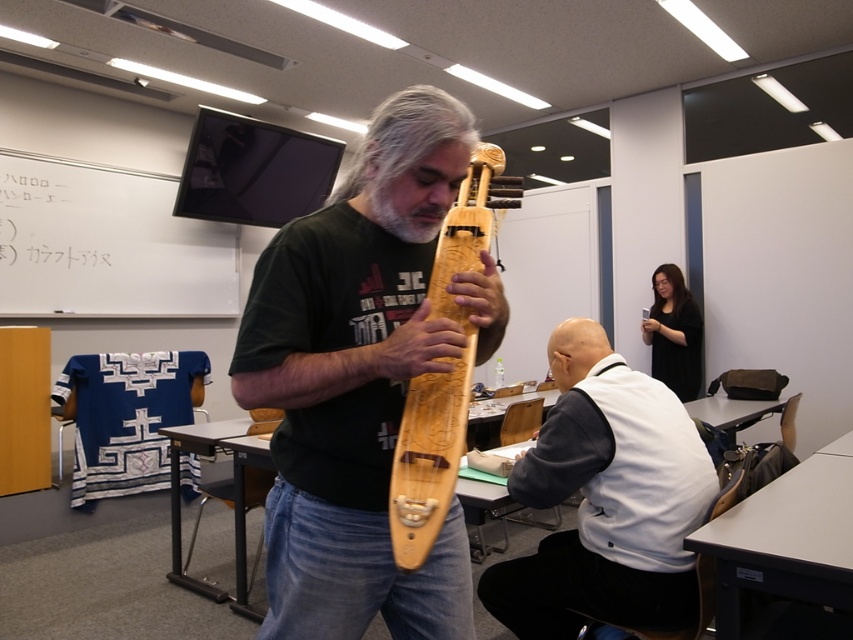
Question: Can you confirm if white matte vest at center is positioned to the right of wooden carved guitar at center?

Choices:
 (A) yes
 (B) no

Answer: (A)

Question: Estimate the real-world distances between objects in this image. Which object is farther from the wooden carved guitar at center?

Choices:
 (A) wooden carved instrument at center
 (B) white matte vest at center

Answer: (B)

Question: Does wooden carved instrument at center appear on the left side of white matte vest at center?

Choices:
 (A) yes
 (B) no

Answer: (A)

Question: Estimate the real-world distances between objects in this image. Which object is farther from the wooden carved instrument at center?

Choices:
 (A) white matte vest at center
 (B) wooden carved guitar at center

Answer: (A)

Question: Which point appears closest to the camera in this image?

Choices:
 (A) (445, 321)
 (B) (444, 506)
 (C) (641, 561)

Answer: (B)

Question: Can you confirm if wooden carved instrument at center is positioned to the left of white matte vest at center?

Choices:
 (A) no
 (B) yes

Answer: (B)